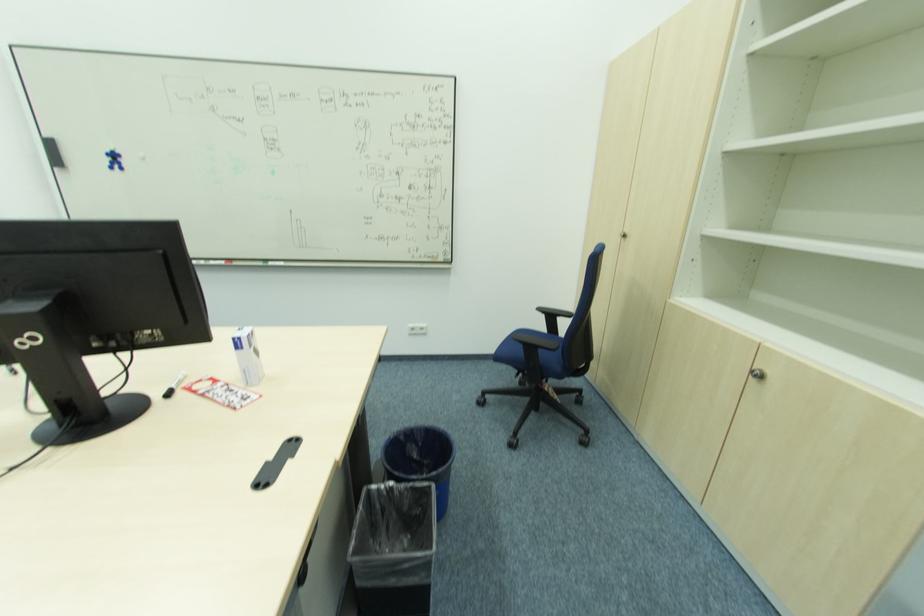
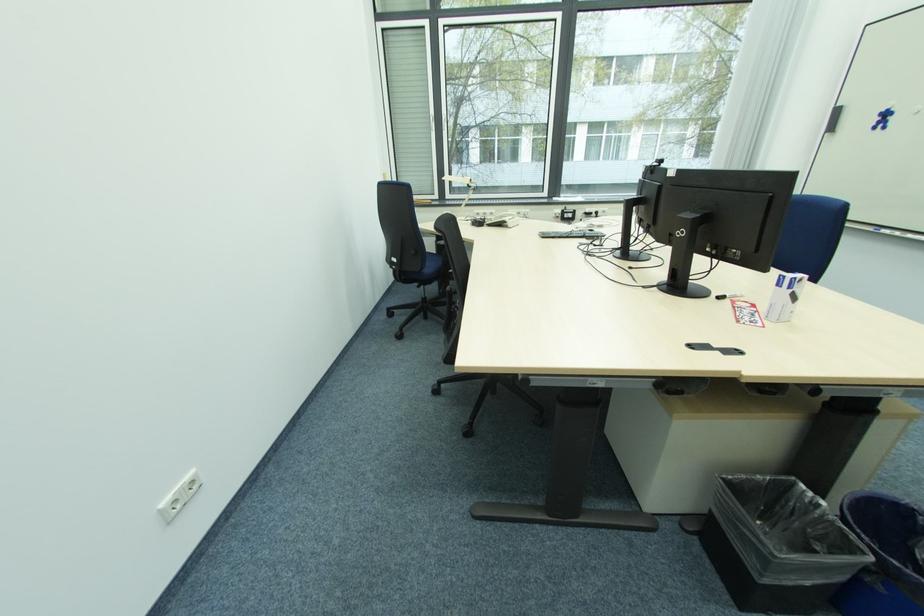
In the second image, find the point that corresponds to point 436,488 in the first image.

(874, 562)